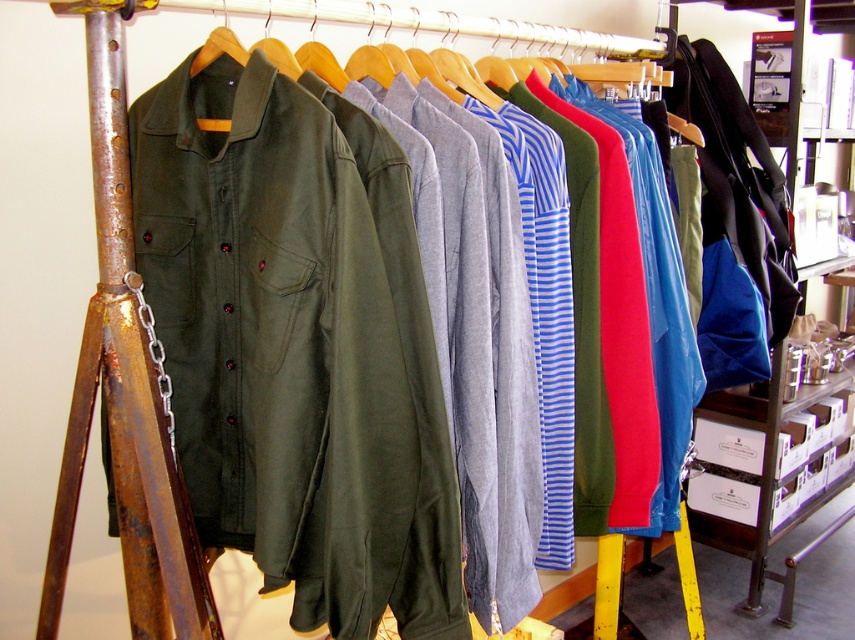
You are standing in front of the clothing rack and want to pick up an item from the rack. If your hand can reach up to 1.1 meters, will you be able to reach the point at coordinates point (x=251, y=307)?

The point (x=251, y=307) is 1.12 meters away from the viewer. Since your hand can reach up to 1.1 meters, you will not be able to reach the point (x=251, y=307) as it is slightly out of reach.

You are organizing a store and need to access the rusty metal ladder at left. However, there is an olive green cotton jacket at left blocking your path. Can you reach the ladder without moving the jacket?

The rusty metal ladder at left is behind olive green cotton jacket at left, so you can reach the ladder without moving the jacket because it is positioned behind the jacket.

You are standing in front of a clothing rack with an olive green cotton jacket at left. If you want to reach the jacket, will you need to move closer than 3 feet?

The olive green cotton jacket at left and viewer are 36.92 inches apart. Since 36.92 inches is approximately 3.08 feet, you need to move slightly closer than 3 feet to reach it.